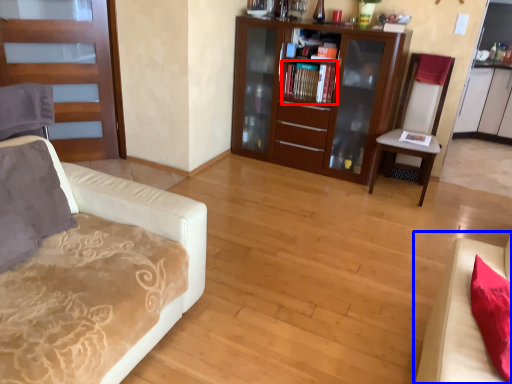
Question: Which object appears farthest to the camera in this image, book (highlighted by a red box) or studio couch (highlighted by a blue box)?

Choices:
 (A) book
 (B) studio couch

Answer: (A)